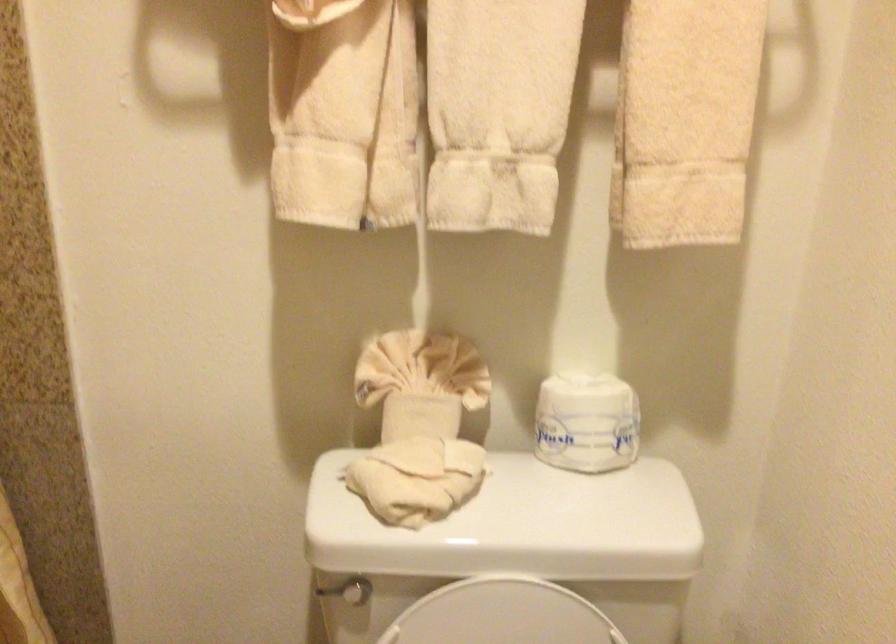
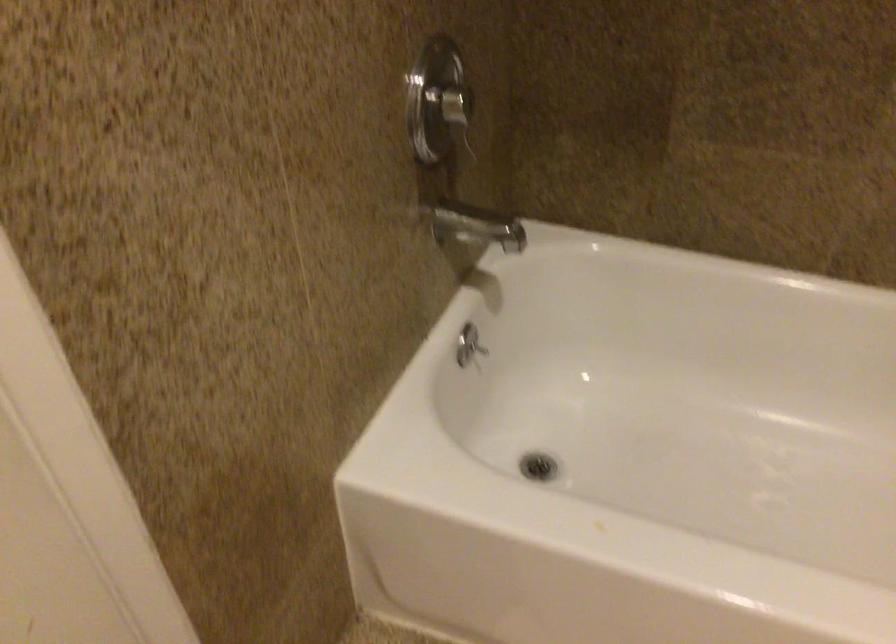
The images are taken continuously from a first-person perspective. In which direction is your viewpoint rotating?

The camera rotated toward left-down.